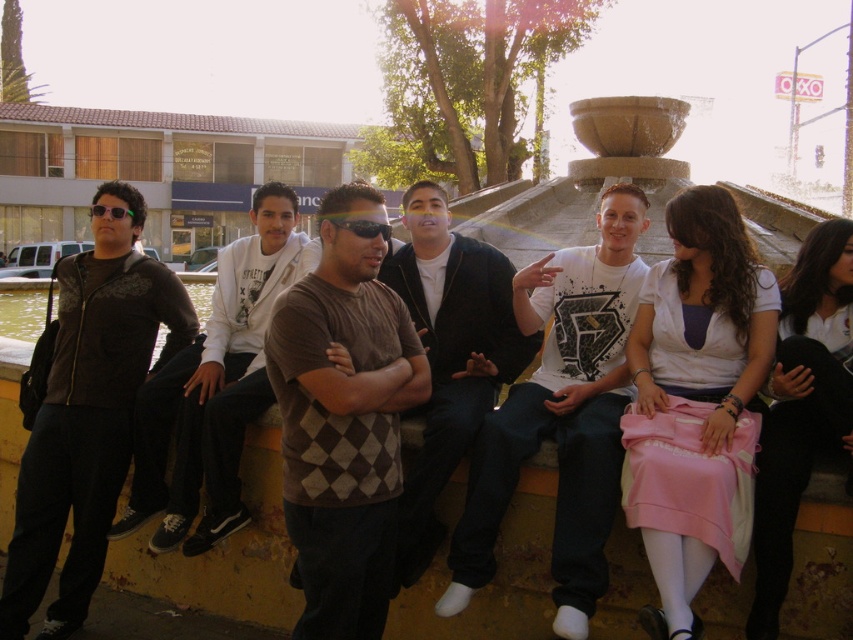
You are a photographer trying to capture a candid shot of the argyle sweater at center and the matte black sunglasses at center in the scene. Given that your camera has a maximum focus range of 3 meters, will you be able to capture both objects in focus at the same time?

The argyle sweater at center and matte black sunglasses at center are 3.54 meters apart. Since the camera can only focus up to 3 meters, the distance between them exceeds the focus range. Therefore, you cannot capture both in focus simultaneously.

You are a photographer trying to capture a closeup of the brown argyle sweater at center and the matte black sunglasses at center. Since you want to focus on both objects equally, which one should you adjust the camera focus on first?

The brown argyle sweater at center occupies less space than matte black sunglasses at center, so you should focus on the matte black sunglasses at center first to ensure both are in focus.